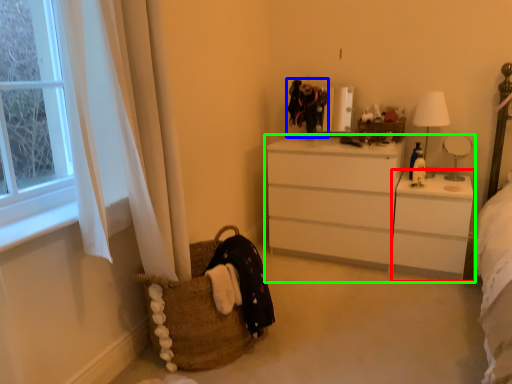
Question: Which object is positioned closest to changing table (highlighted by a red box)? Select from clothing (highlighted by a blue box) and chest of drawers (highlighted by a green box).

Choices:
 (A) clothing
 (B) chest of drawers

Answer: (B)